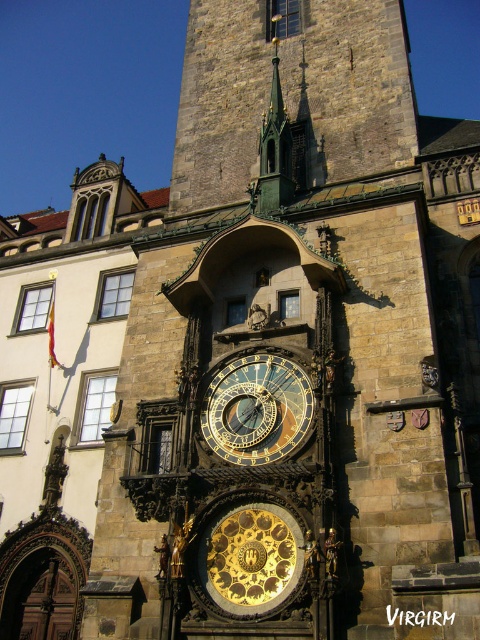
Question: Can you confirm if gold metallic clock at center is bigger than green metallic spire at upper center?

Choices:
 (A) no
 (B) yes

Answer: (A)

Question: Which point is closer to the camera taking this photo?

Choices:
 (A) click(x=266, y=577)
 (B) click(x=249, y=364)

Answer: (A)

Question: Can you confirm if gold plated clock at center is thinner than green metallic spire at upper center?

Choices:
 (A) no
 (B) yes

Answer: (B)

Question: Among these objects, which one is nearest to the camera?

Choices:
 (A) green metallic spire at upper center
 (B) gold plated clock at center
 (C) gold metallic clock at center

Answer: (B)

Question: Which of the following is the farthest from the observer?

Choices:
 (A) gold metallic clock at center
 (B) green metallic spire at upper center
 (C) gold plated clock at center

Answer: (B)

Question: Does gold plated clock at center lie in front of green metallic spire at upper center?

Choices:
 (A) yes
 (B) no

Answer: (A)